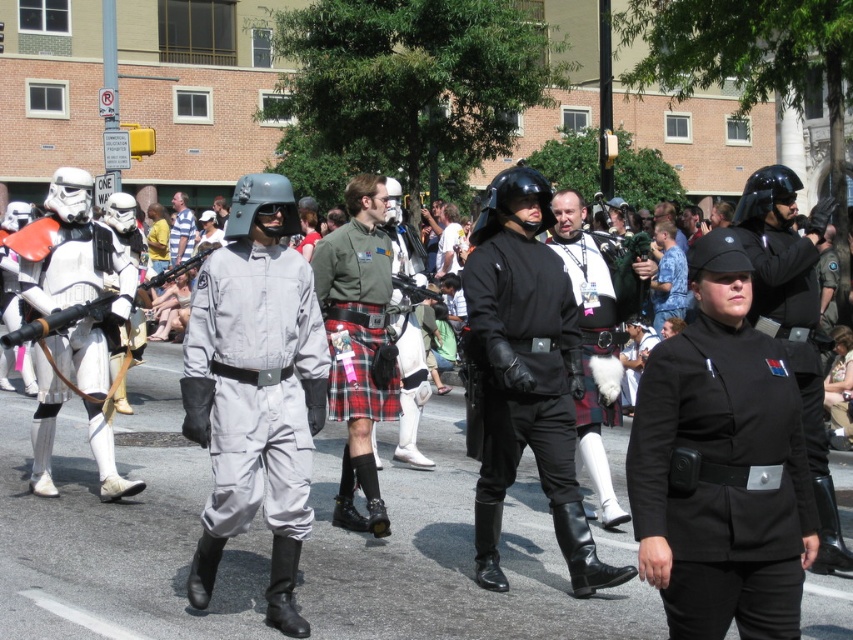
You are a photographer at the parade. You want to take a photo that includes both the black matte uniform at center and the white matte stormtrooper armor at left. Which of the two should be positioned closer to the camera to ensure both are fully visible in the frame?

The black matte uniform at center is shorter than the white matte stormtrooper armor at left, so positioning the black matte uniform at center closer to the camera will ensure both are fully visible in the frame.

You are a photographer positioned at the front of the parade route. You want to capture a clear photo of the black leather helmet at center without the black matte uniform at center blocking it. Is this possible with your current position?

The black matte uniform at center is in front of the black leather helmet at center, so you cannot capture a clear photo of the black leather helmet at center without the black matte uniform at center blocking it from your current position.

You are a photographer at the parade trying to capture a photo of both the black matte uniform at center and the white matte stormtrooper armor at left. Since you can only focus on one subject at a time, which one should you adjust your camera to focus on first if you want to include both in the frame without moving your position?

The black matte uniform at center is to the right of the white matte stormtrooper armor at left. To include both in the frame without moving, focus on the white matte stormtrooper armor at left first, as it is on the left side, allowing you to adjust the camera to encompass both subjects from left to right.